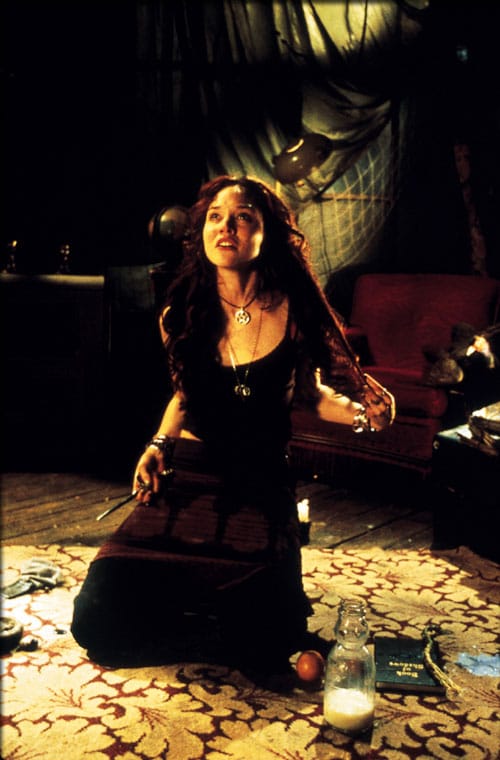
Where is `rug`? This screenshot has width=500, height=760. rug is located at coordinates (123, 714).